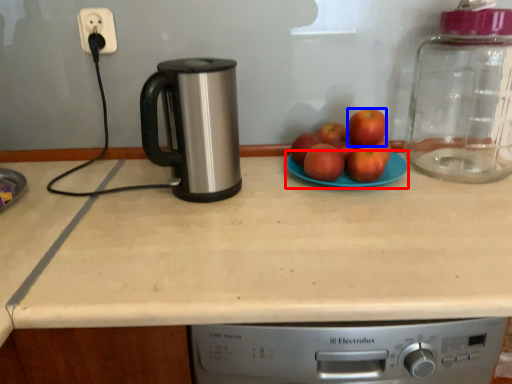
Question: Which point is further to the camera, paper plate (highlighted by a red box) or apple (highlighted by a blue box)?

Choices:
 (A) paper plate
 (B) apple

Answer: (B)